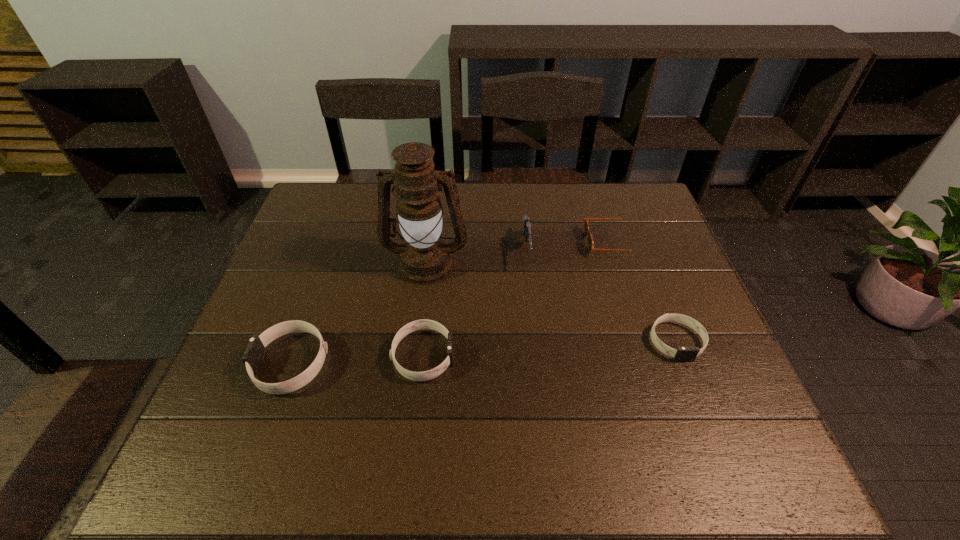
The image size is (960, 540). I want to click on the leftmost wristband, so click(x=255, y=351).

The height and width of the screenshot is (540, 960). Find the location of `the second wristband from left to right`. the second wristband from left to right is located at coordinates (416, 325).

The height and width of the screenshot is (540, 960). What are the coordinates of `the shortest wristband` in the screenshot? It's located at 682,354.

I want to click on sunglasses, so click(591, 248).

Identify the location of oil lamp. pyautogui.click(x=425, y=258).

This screenshot has width=960, height=540. Find the location of `the fourth object from left to right`. the fourth object from left to right is located at coordinates (526, 221).

Identify the location of gun. (526, 221).

At what (x,y) coordinates should I click in order to perform the action: click on free space located on the outer surface of the second shortest wristband. Please return your answer as a coordinate pair (x, y). Image resolution: width=960 pixels, height=540 pixels. Looking at the image, I should click on click(566, 356).

Image resolution: width=960 pixels, height=540 pixels. Find the location of `free space located on the outer surface of the rightmost wristband`. free space located on the outer surface of the rightmost wristband is located at coordinates (701, 406).

The image size is (960, 540). Identify the location of free region located on the front-facing side of the sunglasses. (497, 242).